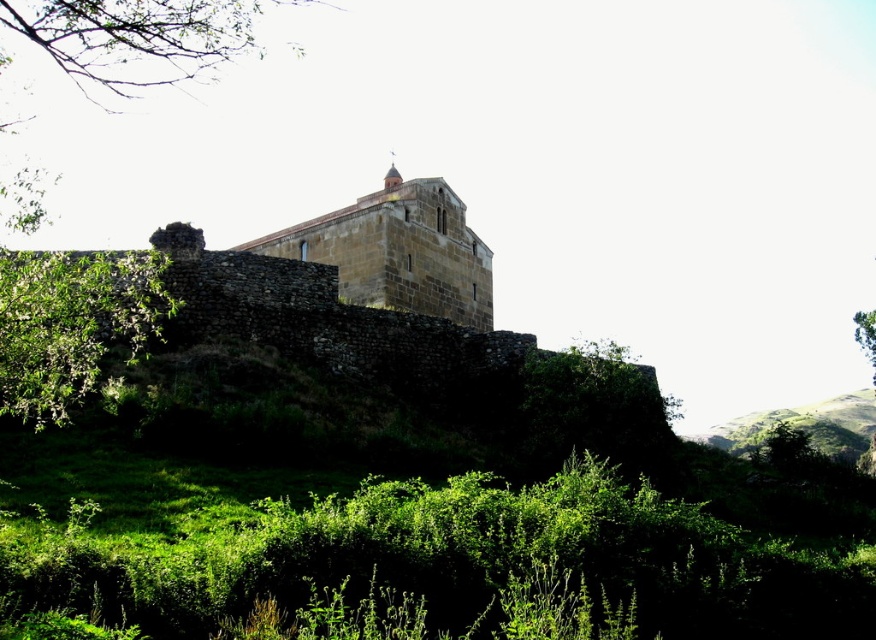
Is brown stone castle at center below green grassy hillside at upper right?

Actually, brown stone castle at center is above green grassy hillside at upper right.

Does point (421, 211) come behind point (782, 420)?

No, it is not.

Which is behind, point (460, 225) or point (729, 436)?

Point (729, 436)

Locate an element on the screen. This screenshot has height=640, width=876. brown stone castle at center is located at coordinates (397, 252).

Is green leafy tree at upper left to the left of green grassy hillside at upper right from the viewer's perspective?

Yes, green leafy tree at upper left is to the left of green grassy hillside at upper right.

Image resolution: width=876 pixels, height=640 pixels. I want to click on green leafy tree at upper left, so click(x=132, y=42).

Where is `green leafy tree at upper left`? green leafy tree at upper left is located at coordinates (132, 42).

Is green leafy tree at lower left taller than brown stone castle at center?

In fact, green leafy tree at lower left may be shorter than brown stone castle at center.

Is green leafy tree at lower left closer to the viewer compared to brown stone castle at center?

Yes.

Is point (69, 397) positioned after point (414, 280)?

No.

You are a GUI agent. You are given a task and a screenshot of the screen. Output one action in this format:
    pyautogui.click(x=<x>, y=<y>)
    Task: Click on the green leafy tree at lower left
    This screenshot has width=876, height=640.
    Given the screenshot: What is the action you would take?
    pyautogui.click(x=71, y=324)